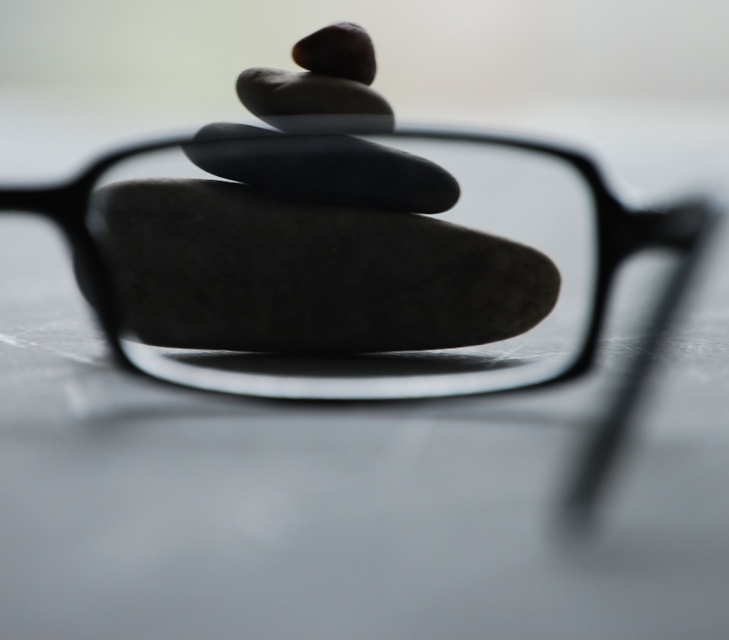
This screenshot has width=729, height=640. I want to click on black matte glasses at center, so click(389, 355).

Can you confirm if black matte glasses at center is wider than smooth gray rock at center?

Indeed, black matte glasses at center has a greater width compared to smooth gray rock at center.

Is point (79, 301) behind point (262, 323)?

Yes, point (79, 301) is behind point (262, 323).

Identify the location of black matte glasses at center. The image size is (729, 640). (389, 355).